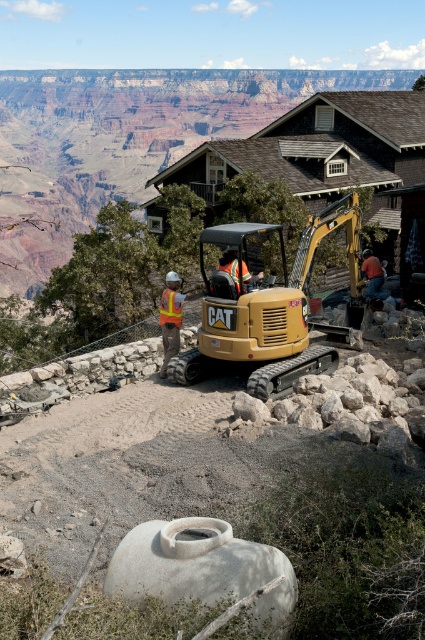
Which of these two, reflective orange vest at center or orange reflective safety vest at center, stands taller?

reflective orange vest at center is taller.

Is the position of reflective orange vest at center more distant than that of orange reflective safety vest at center?

Yes, reflective orange vest at center is further from the viewer.

Image resolution: width=425 pixels, height=640 pixels. Describe the element at coordinates (170, 317) in the screenshot. I see `reflective orange vest at center` at that location.

Locate an element on the screen. The image size is (425, 640). reflective orange vest at center is located at coordinates (170, 317).

Can you confirm if reflective orange vest at center is wider than reflective yellow safety vest at center?

Indeed, reflective orange vest at center has a greater width compared to reflective yellow safety vest at center.

You are a GUI agent. You are given a task and a screenshot of the screen. Output one action in this format:
    pyautogui.click(x=<x>, y=<y>)
    Task: Click on the reflective orange vest at center
    This screenshot has width=425, height=640.
    Given the screenshot: What is the action you would take?
    pyautogui.click(x=170, y=317)

Can you confirm if orange reflective vest at center is thinner than orange reflective safety vest at center?

No, orange reflective vest at center is not thinner than orange reflective safety vest at center.

Is orange reflective vest at center above orange reflective safety vest at center?

Correct, orange reflective vest at center is located above orange reflective safety vest at center.

Is point (374, 280) positioned behind point (229, 266)?

Yes, point (374, 280) is farther from viewer.

Locate an element on the screen. Image resolution: width=425 pixels, height=640 pixels. orange reflective vest at center is located at coordinates (373, 275).